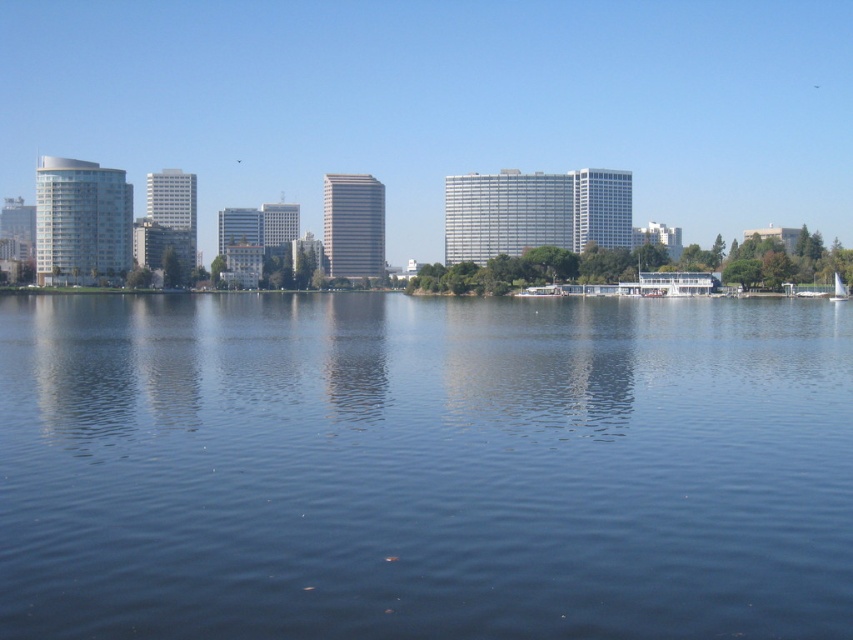
Question: Among these points, which one is nearest to the camera?

Choices:
 (A) (834, 298)
 (B) (329, 381)

Answer: (B)

Question: Is blue liquid water at center thinner than white sailboat at center?

Choices:
 (A) no
 (B) yes

Answer: (A)

Question: Can you confirm if blue liquid water at center is wider than white sailboat at center?

Choices:
 (A) no
 (B) yes

Answer: (B)

Question: Which object is farther from the camera taking this photo?

Choices:
 (A) white sailboat at center
 (B) blue liquid water at center

Answer: (A)

Question: Which object appears farthest from the camera in this image?

Choices:
 (A) white sailboat at center
 (B) blue liquid water at center

Answer: (A)

Question: In this image, where is blue liquid water at center located relative to white sailboat at center?

Choices:
 (A) left
 (B) right

Answer: (A)